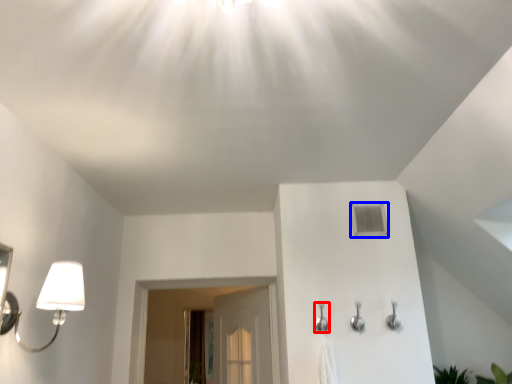
Question: Which of the following is the closest to the observer, shower (highlighted by a red box) or air conditioner (highlighted by a blue box)?

Choices:
 (A) shower
 (B) air conditioner

Answer: (A)